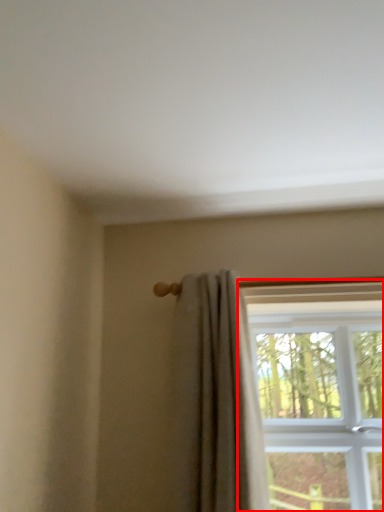
Question: From the image's perspective, what is the correct spatial relationship of window (annotated by the red box) in relation to curtain?

Choices:
 (A) above
 (B) below

Answer: (B)